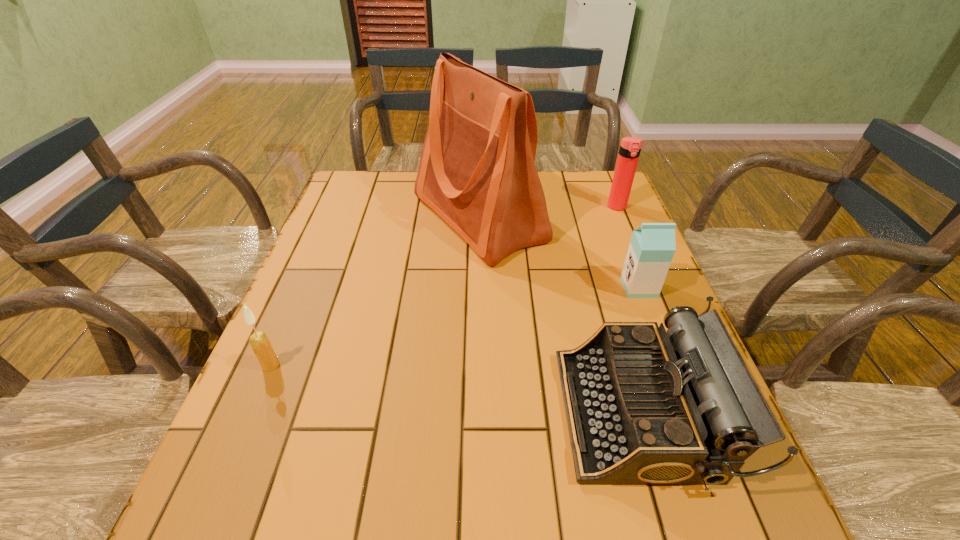
Find the location of `free region located on the keyboard of the typewriter`. free region located on the keyboard of the typewriter is located at coordinates (533, 413).

Where is `vacant area located 0.280m on the keyboard of the typewriter`? The height and width of the screenshot is (540, 960). vacant area located 0.280m on the keyboard of the typewriter is located at coordinates (418, 413).

You are a GUI agent. You are given a task and a screenshot of the screen. Output one action in this format:
    pyautogui.click(x=<x>, y=<y>)
    Task: Click on the shopping bag that is at the far edge
    Image resolution: width=960 pixels, height=540 pixels.
    Given the screenshot: What is the action you would take?
    [477, 172]

At what (x,y) coordinates should I click in order to perform the action: click on thermos bottle located at the far edge. Please return your answer as a coordinate pair (x, y). The image size is (960, 540). Looking at the image, I should click on (630, 147).

Image resolution: width=960 pixels, height=540 pixels. Identify the location of object at the near edge. (644, 406).

Where is `object present at the left edge`? The width and height of the screenshot is (960, 540). object present at the left edge is located at coordinates (260, 344).

Where is `thermos bottle present at the right edge`? The height and width of the screenshot is (540, 960). thermos bottle present at the right edge is located at coordinates (x=630, y=147).

Where is `milk carton located at the right edge`? milk carton located at the right edge is located at coordinates (652, 246).

Identify the location of typewriter that is at the right edge. (644, 406).

Where is `object that is at the far right corner`? This screenshot has width=960, height=540. object that is at the far right corner is located at coordinates (630, 147).